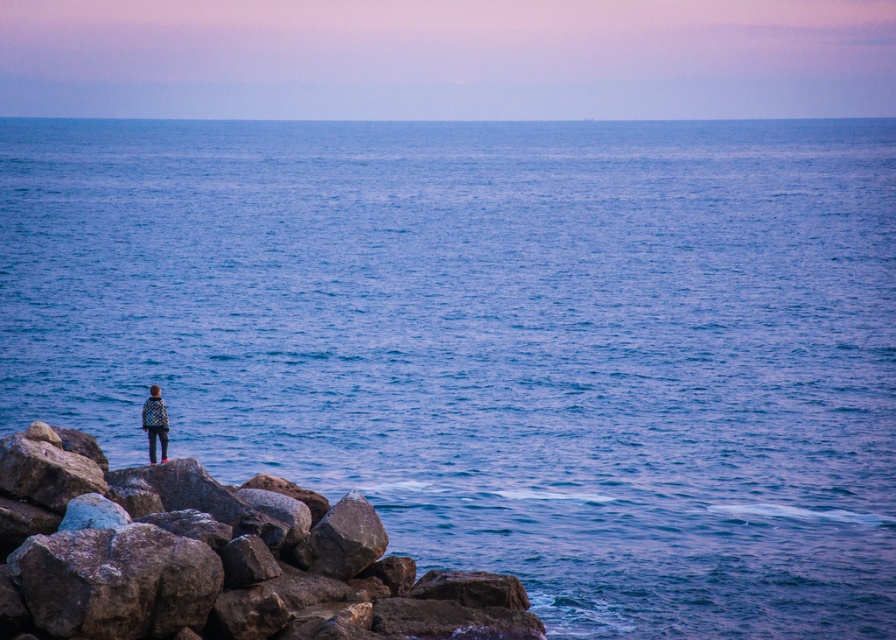
Question: Does rough textured rock at lower left come in front of checkered fabric jacket at lower left?

Choices:
 (A) yes
 (B) no

Answer: (A)

Question: Which point is farther from the camera taking this photo?

Choices:
 (A) (145, 400)
 (B) (220, 568)

Answer: (A)

Question: Which object is farther from the camera taking this photo?

Choices:
 (A) checkered fabric jacket at lower left
 (B) rough textured rock at lower left

Answer: (A)

Question: In this image, where is rough textured rock at lower left located relative to checkered fabric jacket at lower left?

Choices:
 (A) right
 (B) left

Answer: (A)

Question: Which point is farther from the camera taking this photo?

Choices:
 (A) (149, 458)
 (B) (513, 602)

Answer: (A)

Question: Is rough textured rock at lower left to the left of checkered fabric jacket at lower left from the viewer's perspective?

Choices:
 (A) yes
 (B) no

Answer: (B)